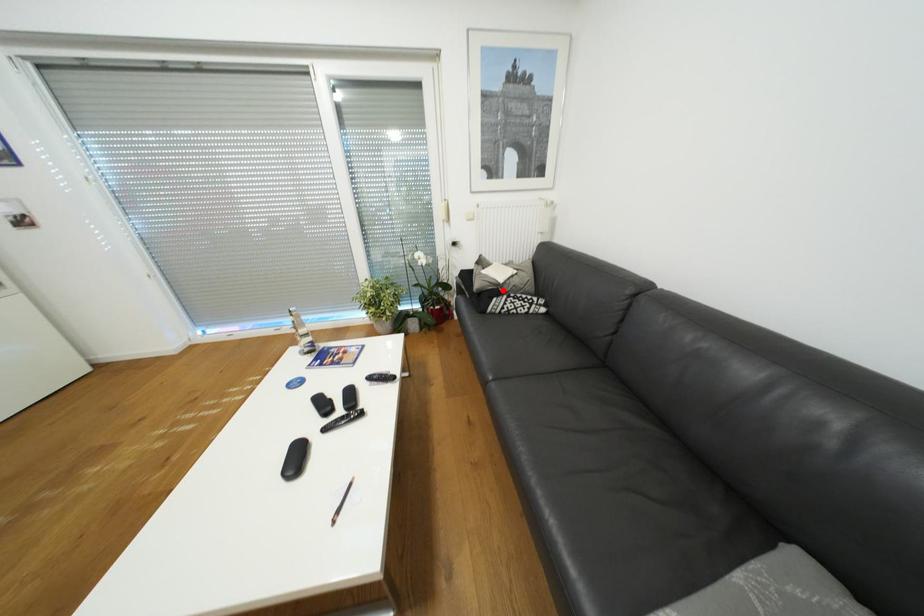
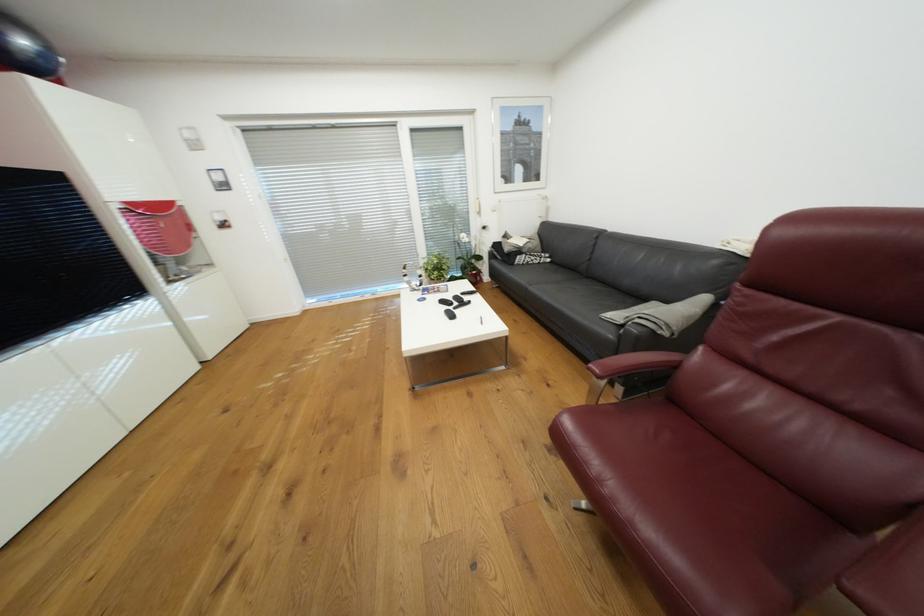
Question: I am providing you with two images of the same scene from different viewpoints. Image1 has a red point marked. In image2, the corresponding 3D location appears at what relative position? Reply with the corresponding letter.

Choices:
 (A) Closer
 (B) Farther

Answer: (A)